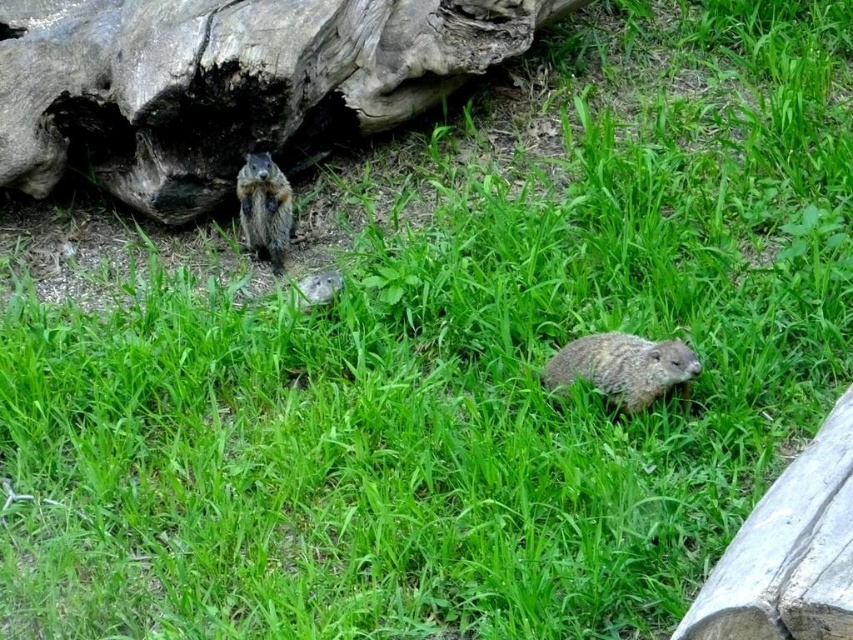
You are a photographer trying to capture both the brown fuzzy beaver at lower center and the brown furry squirrel at center in a single frame. Given their sizes, which animal should you focus on to ensure both fit in the photo without cropping?

The brown fuzzy beaver at lower center is wider than the brown furry squirrel at center. To ensure both fit in the photo without cropping, focus on the brown fuzzy beaver at lower center since its larger size will require more space in the frame.

What are the coordinates of the weathered wood log at upper left?

The weathered wood log at upper left is located at coordinates point (225, 83).

You are a photographer trying to capture both the brown fuzzy beaver at lower center and the brown furry squirrel at center in a single shot. Which animal should you focus on first if you want to ensure both are in frame without moving the camera?

The brown fuzzy beaver at lower center has a lesser height compared to the brown furry squirrel at center, so you should focus on the taller brown furry squirrel at center first to ensure both are in frame.